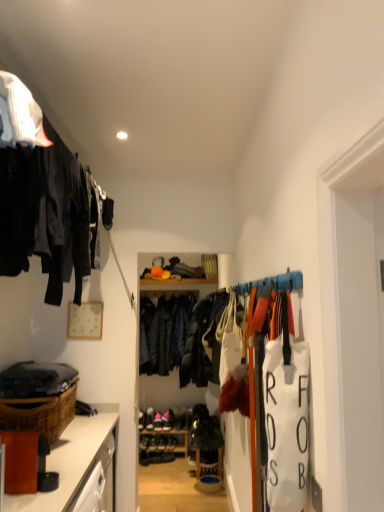
Question: Would you say pink suede shoes at center contains brown woven basket at lower left?

Choices:
 (A) no
 (B) yes

Answer: (A)

Question: Would you say pink suede shoes at center is a long distance from brown woven basket at lower left?

Choices:
 (A) yes
 (B) no

Answer: (A)

Question: Is pink suede shoes at center oriented away from brown woven basket at lower left?

Choices:
 (A) yes
 (B) no

Answer: (B)

Question: From the image's perspective, is pink suede shoes at center on top of brown woven basket at lower left?

Choices:
 (A) no
 (B) yes

Answer: (A)

Question: Does pink suede shoes at center have a lesser height compared to brown woven basket at lower left?

Choices:
 (A) yes
 (B) no

Answer: (A)

Question: In terms of height, does matte black clothing at upper left look taller or shorter compared to dark blue leather jacket at center?

Choices:
 (A) short
 (B) tall

Answer: (A)

Question: From a real-world perspective, relative to dark blue leather jacket at center, is matte black clothing at upper left vertically above or below?

Choices:
 (A) above
 (B) below

Answer: (A)

Question: Considering the positions of matte black clothing at upper left and dark blue leather jacket at center in the image, is matte black clothing at upper left bigger or smaller than dark blue leather jacket at center?

Choices:
 (A) small
 (B) big

Answer: (B)

Question: Considering the positions of point (1, 98) and point (168, 307), is point (1, 98) closer or farther from the camera than point (168, 307)?

Choices:
 (A) closer
 (B) farther

Answer: (A)

Question: Is point (84, 454) closer or farther from the camera than point (172, 417)?

Choices:
 (A) closer
 (B) farther

Answer: (A)

Question: Visually, is brown wood cabinet at lower left positioned to the left or to the right of pink suede shoes at center?

Choices:
 (A) left
 (B) right

Answer: (A)

Question: From the image's perspective, relative to pink suede shoes at center, is brown wood cabinet at lower left above or below?

Choices:
 (A) above
 (B) below

Answer: (A)

Question: Based on their sizes in the image, would you say brown wood cabinet at lower left is bigger or smaller than pink suede shoes at center?

Choices:
 (A) small
 (B) big

Answer: (B)

Question: From a real-world perspective, is wooden shelf at center physically located above or below brown woven basket at lower left?

Choices:
 (A) above
 (B) below

Answer: (B)

Question: Is wooden shelf at center taller or shorter than brown woven basket at lower left?

Choices:
 (A) short
 (B) tall

Answer: (A)